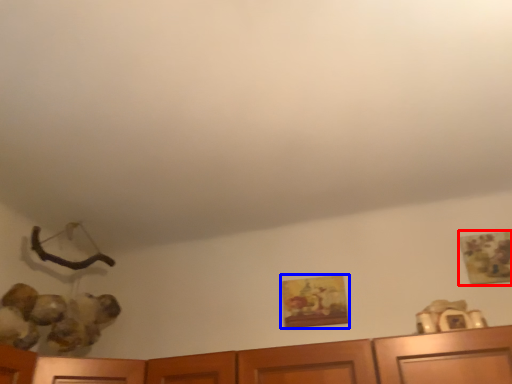
Question: Among these objects, which one is nearest to the camera, picture frame (highlighted by a red box) or picture frame (highlighted by a blue box)?

Choices:
 (A) picture frame
 (B) picture frame

Answer: (A)